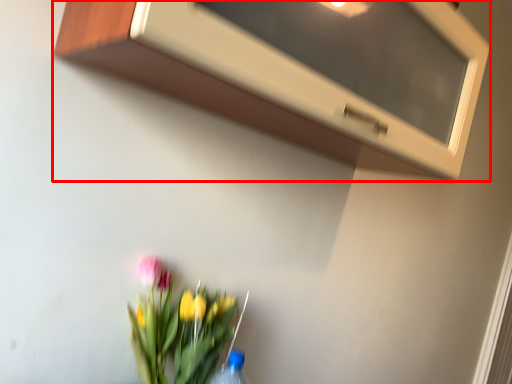
Question: Considering the relative positions of microwave (annotated by the red box) and floral arrangement in the image provided, where is microwave (annotated by the red box) located with respect to the staircase?

Choices:
 (A) left
 (B) right

Answer: (B)